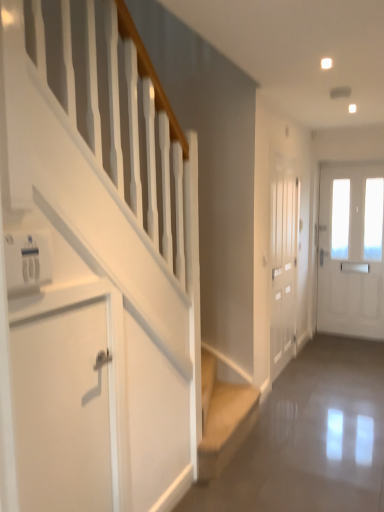
Question: Does white glossy door at right, the third door when ordered from front to back, have a smaller size compared to white frosted glass door at center, which ranks as the second door in back-to-front order?

Choices:
 (A) yes
 (B) no

Answer: (A)

Question: Is white glossy door at right, marked as the third door in a left-to-right arrangement, facing away from white frosted glass door at center, which is the 2th door from left to right?

Choices:
 (A) no
 (B) yes

Answer: (A)

Question: Is white glossy door at right, the third door when ordered from front to back, taller than white frosted glass door at center, which is the 2th door from left to right?

Choices:
 (A) yes
 (B) no

Answer: (B)

Question: Does white glossy door at right, marked as the third door in a left-to-right arrangement, contain white frosted glass door at center, which is the 2th door from left to right?

Choices:
 (A) no
 (B) yes

Answer: (A)

Question: Is white glossy door at right, which appears as the first door when viewed from the back, with white frosted glass door at center, which ranks as the second door in back-to-front order?

Choices:
 (A) no
 (B) yes

Answer: (A)

Question: Looking at their shapes, would you say white glossy door at right, the third door when ordered from front to back, is wider or thinner than beige fabric stairs at lower center?

Choices:
 (A) wide
 (B) thin

Answer: (B)

Question: From a real-world perspective, is white glossy door at right, which is counted as the 1th door, starting from the right, positioned above or below beige fabric stairs at lower center?

Choices:
 (A) above
 (B) below

Answer: (A)

Question: Is white glossy door at right, which appears as the first door when viewed from the back, bigger or smaller than beige fabric stairs at lower center?

Choices:
 (A) big
 (B) small

Answer: (B)

Question: Visually, is white glossy door at right, marked as the third door in a left-to-right arrangement, positioned to the left or to the right of beige fabric stairs at lower center?

Choices:
 (A) left
 (B) right

Answer: (B)

Question: Considering the positions of point (67, 371) and point (289, 353), is point (67, 371) closer or farther from the camera than point (289, 353)?

Choices:
 (A) closer
 (B) farther

Answer: (A)

Question: Is white matte door at lower left, positioned as the third door in right-to-left order, spatially inside white frosted glass door at center, positioned as the second door in right-to-left order, or outside of it?

Choices:
 (A) inside
 (B) outside

Answer: (B)

Question: In the image, is white matte door at lower left, marked as the 1th door in a left-to-right arrangement, on the left side or the right side of white frosted glass door at center, which is the 2th door from left to right?

Choices:
 (A) left
 (B) right

Answer: (A)

Question: Considering the positions of white matte door at lower left, positioned as the third door in right-to-left order, and white frosted glass door at center, positioned as the second door in right-to-left order, in the image, is white matte door at lower left, positioned as the third door in right-to-left order, bigger or smaller than white frosted glass door at center, positioned as the second door in right-to-left order,?

Choices:
 (A) small
 (B) big

Answer: (A)

Question: Is white frosted glass door at center, which is counted as the second door, starting from the front, bigger or smaller than beige fabric stairs at lower center?

Choices:
 (A) big
 (B) small

Answer: (A)

Question: From a real-world perspective, is white frosted glass door at center, which ranks as the second door in back-to-front order, positioned above or below beige fabric stairs at lower center?

Choices:
 (A) below
 (B) above

Answer: (B)